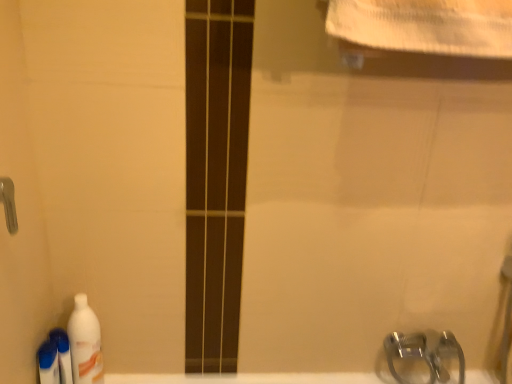
At what (x,y) coordinates should I click in order to perform the action: click on white glossy bottle at lower left, which ranks as the third cleaning product in left-to-right order. Please return your answer as a coordinate pair (x, y). Looking at the image, I should click on (85, 343).

At what (x,y) coordinates should I click in order to perform the action: click on white glossy bath at lower center. Please return your answer as a coordinate pair (x, y). The width and height of the screenshot is (512, 384). Looking at the image, I should click on (247, 378).

Considering the positions of objects white glossy bath at lower center and white glossy bottle at lower left, which ranks as the third cleaning product in left-to-right order, in the image provided, who is behind, white glossy bath at lower center or white glossy bottle at lower left, which ranks as the third cleaning product in left-to-right order,?

white glossy bath at lower center is more distant.

From the white glossy bath at lower center, count 2nd cleaning products forward and point to it. Please provide its 2D coordinates.

[(85, 343)]

Who is shorter, white glossy bath at lower center or white glossy bottle at lower left, which ranks as the first cleaning product in right-to-left order?

With less height is white glossy bath at lower center.

Would you say white glossy bottle at lower left, which ranks as the first cleaning product in right-to-left order, is part of white glossy bath at lower center's contents?

That's incorrect, white glossy bottle at lower left, which ranks as the first cleaning product in right-to-left order, is not inside white glossy bath at lower center.

Considering the positions of points (64, 364) and (353, 372), is point (64, 364) farther from camera compared to point (353, 372)?

No, (64, 364) is closer to viewer.

Would you say white glossy bottle at lower left, the second cleaning product in the left-to-right sequence, is inside or outside white glossy bath at lower center?

white glossy bottle at lower left, the second cleaning product in the left-to-right sequence, cannot be found inside white glossy bath at lower center.

Which object is closer to the camera taking this photo, white glossy bottle at lower left, which is the second cleaning product from right to left, or white glossy bath at lower center?

white glossy bottle at lower left, which is the second cleaning product from right to left, is closer to the camera.

Are white glossy bottle at lower left, which ranks as the third cleaning product in left-to-right order, and translucent plastic bottle at lower left, the 3th cleaning product positioned from the right, beside each other?

Yes, white glossy bottle at lower left, which ranks as the third cleaning product in left-to-right order, is with translucent plastic bottle at lower left, the 3th cleaning product positioned from the right.

Is white glossy bottle at lower left, which ranks as the first cleaning product in right-to-left order, shorter than translucent plastic bottle at lower left, the 1th cleaning product in the left-to-right sequence?

In fact, white glossy bottle at lower left, which ranks as the first cleaning product in right-to-left order, may be taller than translucent plastic bottle at lower left, the 1th cleaning product in the left-to-right sequence.

Is the depth of white glossy bottle at lower left, which ranks as the first cleaning product in right-to-left order, greater than that of translucent plastic bottle at lower left, the 1th cleaning product in the left-to-right sequence?

Yes, white glossy bottle at lower left, which ranks as the first cleaning product in right-to-left order, is further from the camera.

Is white glossy bottle at lower left, which ranks as the third cleaning product in left-to-right order, oriented away from translucent plastic bottle at lower left, the 3th cleaning product positioned from the right?

No.

From the image's perspective, is white glossy bottle at lower left, the second cleaning product in the left-to-right sequence, below white glossy bottle at lower left, which ranks as the first cleaning product in right-to-left order?

Correct, white glossy bottle at lower left, the second cleaning product in the left-to-right sequence, appears lower than white glossy bottle at lower left, which ranks as the first cleaning product in right-to-left order, in the image.

Choose the correct answer: Is white glossy bottle at lower left, which is the second cleaning product from right to left, inside white glossy bottle at lower left, which ranks as the third cleaning product in left-to-right order, or outside it?

white glossy bottle at lower left, which is the second cleaning product from right to left, lies outside white glossy bottle at lower left, which ranks as the third cleaning product in left-to-right order.

From a real-world perspective, which is physically above, white glossy bottle at lower left, the second cleaning product in the left-to-right sequence, or white glossy bottle at lower left, which ranks as the third cleaning product in left-to-right order?

white glossy bottle at lower left, which ranks as the third cleaning product in left-to-right order, is physically above.

In the scene shown: Are white glossy bottle at lower left, which is the second cleaning product from right to left, and white glossy bottle at lower left, which ranks as the third cleaning product in left-to-right order, far apart?

No, there isn't a large distance between white glossy bottle at lower left, which is the second cleaning product from right to left, and white glossy bottle at lower left, which ranks as the third cleaning product in left-to-right order.

Is point (46, 347) behind point (62, 344)?

No.

Is translucent plastic bottle at lower left, the 1th cleaning product in the left-to-right sequence, wider than white glossy bottle at lower left, the second cleaning product in the left-to-right sequence?

Indeed, translucent plastic bottle at lower left, the 1th cleaning product in the left-to-right sequence, has a greater width compared to white glossy bottle at lower left, the second cleaning product in the left-to-right sequence.

Find the location of a particular element. The image size is (512, 384). cleaning product that is the 1st one when counting rightward from the translucent plastic bottle at lower left, the 1th cleaning product in the left-to-right sequence is located at coordinates (63, 354).

Can you see white glossy bottle at lower left, which ranks as the third cleaning product in left-to-right order, touching white glossy bath at lower center?

No, white glossy bottle at lower left, which ranks as the third cleaning product in left-to-right order, is not in contact with white glossy bath at lower center.

I want to click on bath located below the white glossy bottle at lower left, which ranks as the third cleaning product in left-to-right order (from the image's perspective), so click(x=247, y=378).

From a real-world perspective, is white glossy bottle at lower left, which ranks as the third cleaning product in left-to-right order, over white glossy bath at lower center?

Yes, from a real-world perspective, white glossy bottle at lower left, which ranks as the third cleaning product in left-to-right order, is over white glossy bath at lower center

Which object is thinner, white glossy bottle at lower left, which ranks as the first cleaning product in right-to-left order, or white glossy bath at lower center?

With smaller width is white glossy bath at lower center.

Is white glossy bottle at lower left, the second cleaning product in the left-to-right sequence, positioned with its back to translucent plastic bottle at lower left, the 3th cleaning product positioned from the right?

Absolutely, white glossy bottle at lower left, the second cleaning product in the left-to-right sequence, is directed away from translucent plastic bottle at lower left, the 3th cleaning product positioned from the right.

The image size is (512, 384). In order to click on cleaning product located underneath the white glossy bottle at lower left, the second cleaning product in the left-to-right sequence (from a real-world perspective) in this screenshot , I will do `click(48, 363)`.

From a real-world perspective, which object rests below the other?

translucent plastic bottle at lower left, the 3th cleaning product positioned from the right, is physically lower.

Considering their positions, is white glossy bottle at lower left, which is the second cleaning product from right to left, located in front of or behind translucent plastic bottle at lower left, the 1th cleaning product in the left-to-right sequence?

Clearly, white glossy bottle at lower left, which is the second cleaning product from right to left, is behind translucent plastic bottle at lower left, the 1th cleaning product in the left-to-right sequence.

You are a GUI agent. You are given a task and a screenshot of the screen. Output one action in this format:
    pyautogui.click(x=<x>, y=<y>)
    Task: Click on the cleaning product that is the 3rd object located above the white glossy bath at lower center (from the image's perspective)
    
    Given the screenshot: What is the action you would take?
    pyautogui.click(x=85, y=343)

Image resolution: width=512 pixels, height=384 pixels. Find the location of `bath below the white glossy bottle at lower left, which is the second cleaning product from right to left (from the image's perspective)`. bath below the white glossy bottle at lower left, which is the second cleaning product from right to left (from the image's perspective) is located at coordinates (247, 378).

When comparing their distances from white glossy bottle at lower left, which ranks as the first cleaning product in right-to-left order, does white glossy bath at lower center or white glossy bottle at lower left, the second cleaning product in the left-to-right sequence, seem closer?

Among the two, white glossy bottle at lower left, the second cleaning product in the left-to-right sequence, is located nearer to white glossy bottle at lower left, which ranks as the first cleaning product in right-to-left order.

When comparing their distances from white glossy bath at lower center, does white glossy bottle at lower left, which ranks as the third cleaning product in left-to-right order, or white glossy bottle at lower left, which is the second cleaning product from right to left, seem closer?

white glossy bottle at lower left, which ranks as the third cleaning product in left-to-right order.

Which object lies nearer to the anchor point translucent plastic bottle at lower left, the 1th cleaning product in the left-to-right sequence, white glossy bottle at lower left, which ranks as the first cleaning product in right-to-left order, or white glossy bottle at lower left, the second cleaning product in the left-to-right sequence?

white glossy bottle at lower left, the second cleaning product in the left-to-right sequence.

Looking at the image, which one is located further to white glossy bottle at lower left, which ranks as the third cleaning product in left-to-right order, white glossy bottle at lower left, which is the second cleaning product from right to left, or white glossy bath at lower center?

white glossy bath at lower center is positioned further to the anchor white glossy bottle at lower left, which ranks as the third cleaning product in left-to-right order.

Looking at the image, which one is located closer to white glossy bottle at lower left, which ranks as the first cleaning product in right-to-left order, white glossy bottle at lower left, the second cleaning product in the left-to-right sequence, or translucent plastic bottle at lower left, the 3th cleaning product positioned from the right?

The object closer to white glossy bottle at lower left, which ranks as the first cleaning product in right-to-left order, is white glossy bottle at lower left, the second cleaning product in the left-to-right sequence.

From the image, which object appears to be nearer to white glossy bath at lower center, translucent plastic bottle at lower left, the 1th cleaning product in the left-to-right sequence, or white glossy bottle at lower left, which is the second cleaning product from right to left?

Among the two, white glossy bottle at lower left, which is the second cleaning product from right to left, is located nearer to white glossy bath at lower center.

Looking at the image, which one is located closer to white glossy bottle at lower left, which ranks as the first cleaning product in right-to-left order, translucent plastic bottle at lower left, the 3th cleaning product positioned from the right, or white glossy bottle at lower left, which is the second cleaning product from right to left?

Based on the image, white glossy bottle at lower left, which is the second cleaning product from right to left, appears to be nearer to white glossy bottle at lower left, which ranks as the first cleaning product in right-to-left order.

Estimate the real-world distances between objects in this image. Which object is further from translucent plastic bottle at lower left, the 3th cleaning product positioned from the right, white glossy bottle at lower left, which ranks as the first cleaning product in right-to-left order, or white glossy bath at lower center?

white glossy bath at lower center is further to translucent plastic bottle at lower left, the 3th cleaning product positioned from the right.

This screenshot has width=512, height=384. Identify the location of cleaning product situated between white glossy bottle at lower left, which is the second cleaning product from right to left, and white glossy bath at lower center from left to right. (85, 343).

This screenshot has width=512, height=384. I want to click on cleaning product between white glossy bottle at lower left, which ranks as the first cleaning product in right-to-left order, and translucent plastic bottle at lower left, the 1th cleaning product in the left-to-right sequence, in the vertical direction, so click(x=63, y=354).